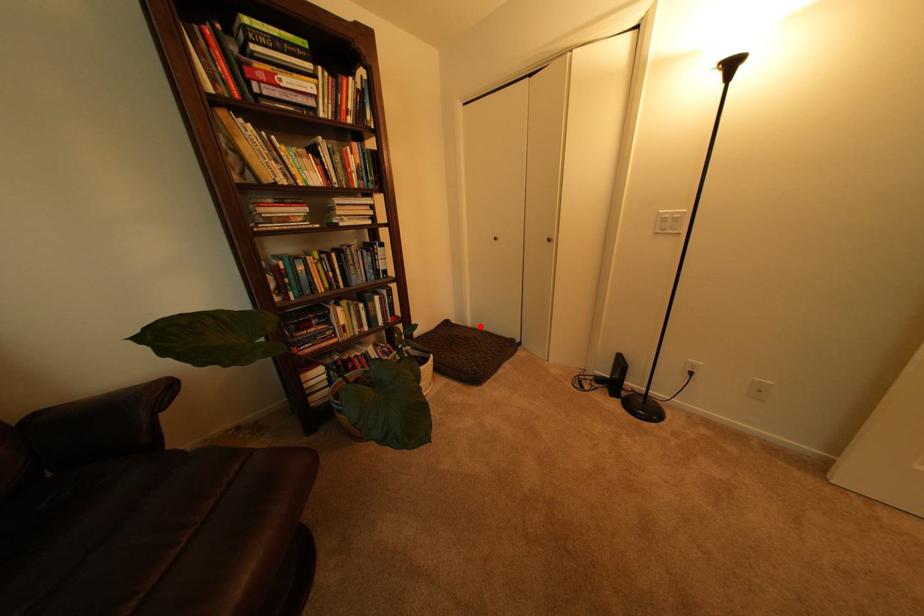
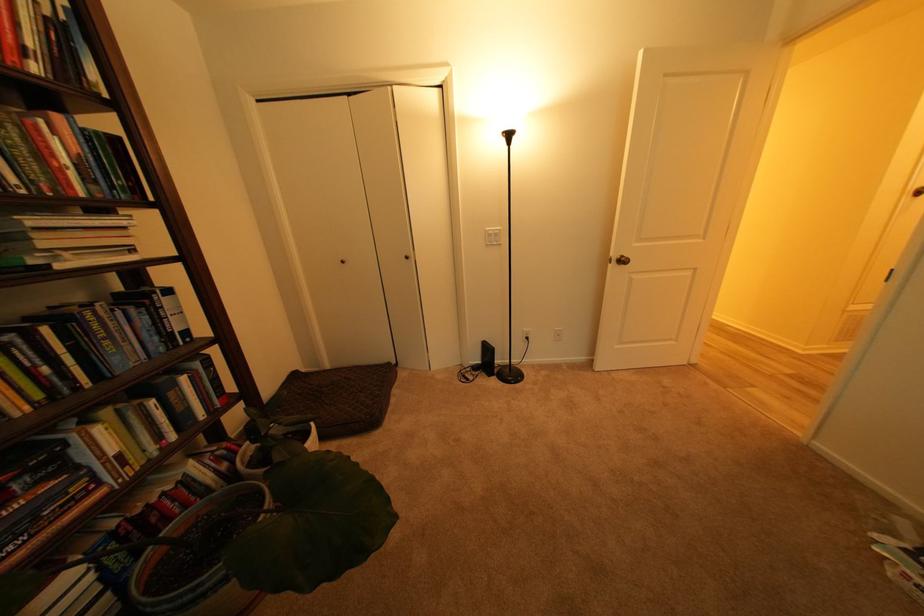
Locate, in the second image, the point that corresponds to the highlighted location in the first image.

(338, 368)